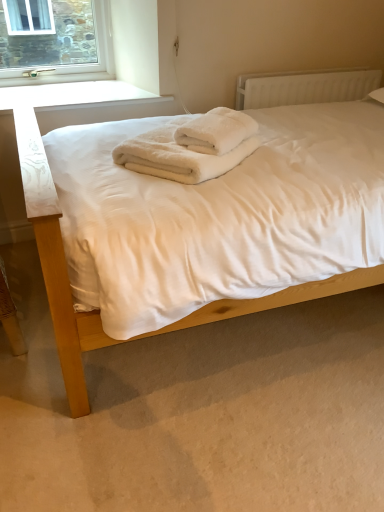
You are a GUI agent. You are given a task and a screenshot of the screen. Output one action in this format:
    pyautogui.click(x=<x>, y=<y>)
    Task: Click on the white fluffy towels at center
    This screenshot has height=512, width=384.
    Given the screenshot: What is the action you would take?
    pyautogui.click(x=216, y=131)

What are the coordinates of `white plastic radiator at upper right` in the screenshot? It's located at (304, 87).

The width and height of the screenshot is (384, 512). In order to click on white soft bed at center in this screenshot , I will do `click(58, 220)`.

How distant is white soft bed at center from white fluffy towels at center?

white soft bed at center and white fluffy towels at center are 18.96 inches apart from each other.

Between point (95, 335) and point (150, 168), which one is positioned in front?

The point (95, 335) is closer to the camera.

Is white soft bed at center located outside white fluffy towels at center?

Yes, white soft bed at center is located beyond the bounds of white fluffy towels at center.

In terms of height, does white fluffy towels at center look taller or shorter compared to white fluffy towels at center?

white fluffy towels at center is taller than white fluffy towels at center.

Which object is wider, white fluffy towels at center or white fluffy towels at center?

Wider between the two is white fluffy towels at center.

Looking at this image, is white fluffy towels at center positioned far away from white fluffy towels at center?

white fluffy towels at center is near white fluffy towels at center, not far away.

Find the location of `bath towel in front of the white fluffy towels at center`. bath towel in front of the white fluffy towels at center is located at coordinates (189, 147).

Considering the relative sizes of white fluffy towels at center and white plastic radiator at upper right in the image provided, is white fluffy towels at center bigger than white plastic radiator at upper right?

No, white fluffy towels at center is not bigger than white plastic radiator at upper right.

Between white fluffy towels at center and white plastic radiator at upper right, which one is positioned behind?

white plastic radiator at upper right is more distant.

Visually, is white fluffy towels at center positioned to the left or to the right of white plastic radiator at upper right?

white fluffy towels at center is to the left of white plastic radiator at upper right.

Find the location of a particular element. The image size is (384, 512). towel lying below the white plastic radiator at upper right (from the image's perspective) is located at coordinates (216, 131).

The image size is (384, 512). I want to click on towel above the white soft bed at center (from the image's perspective), so click(216, 131).

Does white soft bed at center come in front of white fluffy towels at center?

Yes, white soft bed at center is closer to the viewer.

Is point (46, 227) farther from viewer compared to point (255, 123)?

That is False.

From a real-world perspective, relative to white fluffy towels at center, is white fluffy towels at center vertically above or below?

In terms of real-world spatial position, white fluffy towels at center is above white fluffy towels at center.

From the image's perspective, is white fluffy towels at center over white fluffy towels at center?

Correct, white fluffy towels at center appears higher than white fluffy towels at center in the image.

Is there a large distance between white fluffy towels at center and white fluffy towels at center?

white fluffy towels at center is near white fluffy towels at center, not far away.

In the scene shown: Which is more to the left, white fluffy towels at center or white fluffy towels at center?

white fluffy towels at center is more to the left.

Does white fluffy towels at center have a greater height compared to white soft bed at center?

Incorrect, the height of white fluffy towels at center is not larger of that of white soft bed at center.

Is white fluffy towels at center not near white soft bed at center?

white fluffy towels at center is near white soft bed at center, not far away.

From the image's perspective, between white fluffy towels at center and white soft bed at center, which one is located above?

white fluffy towels at center, from the image's perspective.

This screenshot has width=384, height=512. In order to click on radiator behind the white soft bed at center in this screenshot , I will do tap(304, 87).

Considering the relative sizes of white soft bed at center and white plastic radiator at upper right in the image provided, is white soft bed at center bigger than white plastic radiator at upper right?

Indeed, white soft bed at center has a larger size compared to white plastic radiator at upper right.

From a real-world perspective, relative to white plastic radiator at upper right, is white soft bed at center vertically above or below?

white soft bed at center is below white plastic radiator at upper right.

Which object is positioned more to the left, white soft bed at center or white plastic radiator at upper right?

white soft bed at center.

Locate an element on the screen. The image size is (384, 512). bath towel below the white soft bed at center (from the image's perspective) is located at coordinates (189, 147).

Identify the location of bath towel that appears below the white fluffy towels at center (from a real-world perspective). This screenshot has width=384, height=512. (189, 147).

When comparing their distances from white soft bed at center, does white fluffy towels at center or white plastic radiator at upper right seem closer?

white fluffy towels at center is positioned closer to the anchor white soft bed at center.

Which object lies further to the anchor point white fluffy towels at center, white plastic radiator at upper right or white soft bed at center?

Based on the image, white plastic radiator at upper right appears to be further to white fluffy towels at center.

Based on their spatial positions, is white soft bed at center or white fluffy towels at center further from white plastic radiator at upper right?

white soft bed at center is positioned further to the anchor white plastic radiator at upper right.

Considering their positions, is white fluffy towels at center positioned further to white fluffy towels at center than white plastic radiator at upper right?

Based on the image, white plastic radiator at upper right appears to be further to white fluffy towels at center.

Looking at the image, which one is located further to white soft bed at center, white fluffy towels at center or white plastic radiator at upper right?

Among the two, white plastic radiator at upper right is located further to white soft bed at center.

Looking at this image, estimate the real-world distances between objects in this image. Which object is further from white fluffy towels at center, white soft bed at center or white plastic radiator at upper right?

Based on the image, white plastic radiator at upper right appears to be further to white fluffy towels at center.

In the scene shown: When comparing their distances from white fluffy towels at center, does white plastic radiator at upper right or white fluffy towels at center seem closer?

white fluffy towels at center is positioned closer to the anchor white fluffy towels at center.

From the image, which object appears to be nearer to white fluffy towels at center, white fluffy towels at center or white soft bed at center?

white fluffy towels at center is closer to white fluffy towels at center.

You are a GUI agent. You are given a task and a screenshot of the screen. Output one action in this format:
    pyautogui.click(x=<x>, y=<y>)
    Task: Click on the bath towel located between white soft bed at center and white fluffy towels at center in the depth direction
    
    Given the screenshot: What is the action you would take?
    pyautogui.click(x=189, y=147)

Identify the location of bath towel between white soft bed at center and white plastic radiator at upper right in the front-back direction. (189, 147).

Locate an element on the screen. This screenshot has height=512, width=384. towel positioned between white fluffy towels at center and white plastic radiator at upper right from near to far is located at coordinates (216, 131).

Identify the location of towel positioned between white soft bed at center and white plastic radiator at upper right from near to far. (216, 131).